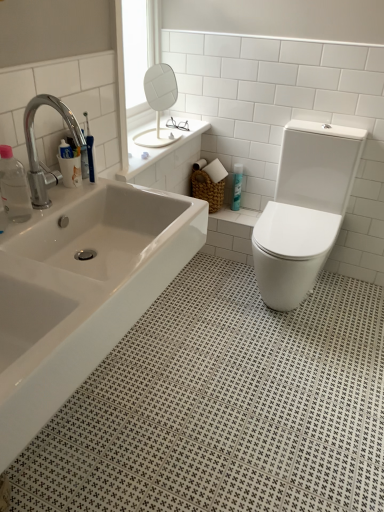
Question: Considering the relative sizes of white glossy bathtub at center and chrome metallic faucet at upper left in the image provided, is white glossy bathtub at center shorter than chrome metallic faucet at upper left?

Choices:
 (A) yes
 (B) no

Answer: (B)

Question: From the image's perspective, is white glossy bathtub at center over chrome metallic faucet at upper left?

Choices:
 (A) no
 (B) yes

Answer: (A)

Question: Is white glossy bathtub at center oriented away from chrome metallic faucet at upper left?

Choices:
 (A) yes
 (B) no

Answer: (B)

Question: Is white glossy bathtub at center to the left of chrome metallic faucet at upper left from the viewer's perspective?

Choices:
 (A) no
 (B) yes

Answer: (A)

Question: Is the position of white glossy bathtub at center less distant than that of chrome metallic faucet at upper left?

Choices:
 (A) yes
 (B) no

Answer: (A)

Question: In terms of height, does white glossy bathtub at center look taller or shorter compared to blue glossy spray can at center, marked as the first toiletry in a top-to-bottom arrangement?

Choices:
 (A) short
 (B) tall

Answer: (B)

Question: From a real-world perspective, is white glossy bathtub at center physically located above or below blue glossy spray can at center, the second toiletry when ordered from bottom to top?

Choices:
 (A) below
 (B) above

Answer: (B)

Question: Visually, is white glossy bathtub at center positioned to the left or to the right of blue glossy spray can at center, the 2th toiletry when ordered from left to right?

Choices:
 (A) right
 (B) left

Answer: (B)

Question: In the image, is white glossy bathtub at center positioned in front of or behind blue glossy spray can at center, which is the 1th toiletry from right to left?

Choices:
 (A) behind
 (B) front

Answer: (B)

Question: Is point (9, 194) closer or farther from the camera than point (150, 130)?

Choices:
 (A) closer
 (B) farther

Answer: (A)

Question: Is transparent plastic bottle at left, positioned as the 2th toiletry in back-to-front order, inside the boundaries of white glossy mirror at upper center, or outside?

Choices:
 (A) outside
 (B) inside

Answer: (A)

Question: Considering their positions, is transparent plastic bottle at left, acting as the second toiletry starting from the right, located in front of or behind white glossy mirror at upper center?

Choices:
 (A) front
 (B) behind

Answer: (A)

Question: Visually, is transparent plastic bottle at left, positioned as the 2th toiletry in back-to-front order, positioned to the left or to the right of white glossy mirror at upper center?

Choices:
 (A) left
 (B) right

Answer: (A)

Question: From a real-world perspective, is chrome metallic faucet at upper left above or below white glossy bathtub at center?

Choices:
 (A) below
 (B) above

Answer: (B)

Question: Is chrome metallic faucet at upper left to the left or to the right of white glossy bathtub at center in the image?

Choices:
 (A) right
 (B) left

Answer: (B)